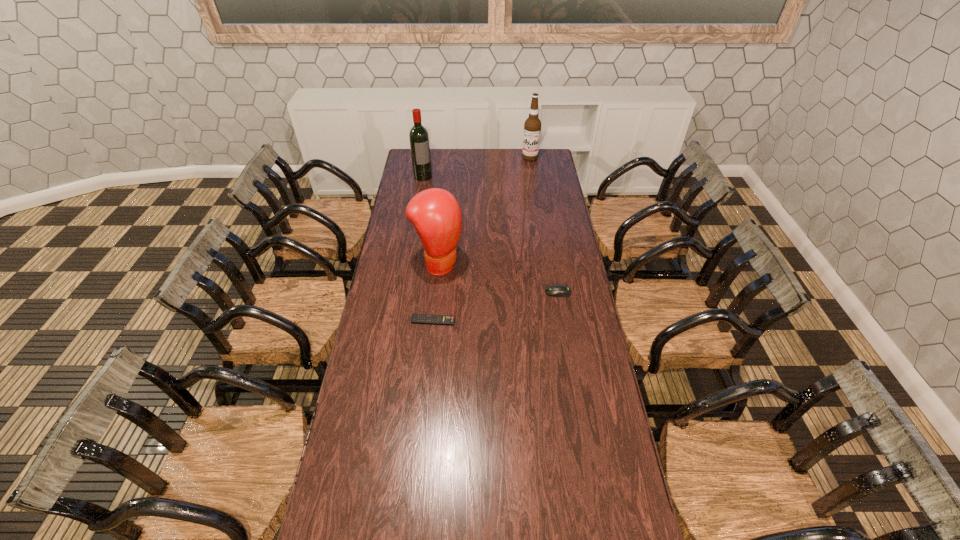
Identify the location of vacant space located on the wheel side of the computer mouse. (498, 292).

The height and width of the screenshot is (540, 960). I want to click on free region located on the label of the fourth nearest object, so click(429, 187).

The image size is (960, 540). What are the coordinates of `free space located on the label of the fourth nearest object` in the screenshot? It's located at click(443, 210).

The height and width of the screenshot is (540, 960). I want to click on vacant space situated on the label of the fourth nearest object, so click(431, 191).

What are the coordinates of `vacant area situated 0.130m on the striking surface of the third farthest object` in the screenshot? It's located at (479, 289).

This screenshot has width=960, height=540. Identify the location of vacant space located on the striking surface of the third farthest object. (530, 321).

In order to click on blank space located on the striking surface of the third farthest object in this screenshot , I will do `click(516, 313)`.

Identify the location of free space located 0.060m on the label of the alcohol. (527, 167).

Locate an element on the screen. Image resolution: width=960 pixels, height=540 pixels. vacant space located on the label of the alcohol is located at coordinates (520, 193).

This screenshot has width=960, height=540. I want to click on vacant space located on the label of the alcohol, so click(527, 170).